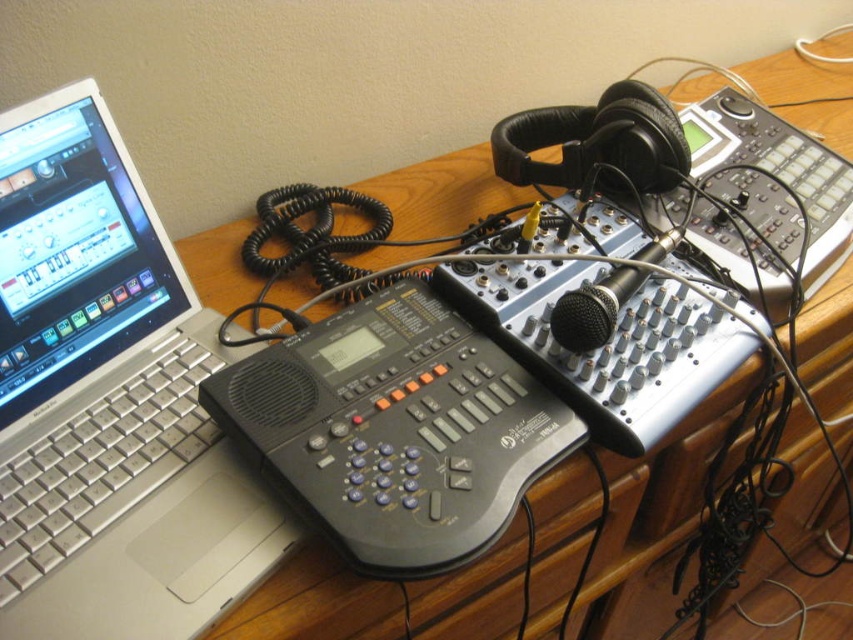
You are setting up a new microphone stand in the workspace. The silver metallic laptop at left is currently at position coordinates 0.628, 0.129. If the microphone stand requires 0.3 meters of space to the right of the laptop, will there be enough room on the desk?

The silver metallic laptop at left is located at point (109, 401). Since the desk space to the right of the laptop must accommodate the microphone stand requiring 0.3 meters, but the exact desk dimensions aren not provided in the scene description, it is impossible to determine if there is sufficient space. Please check the desk size or adjust the stand placement.

You are setting up a new monitor for your audio workstation. The monitor requires a desk space that is wider than the silver metallic laptop at left. Can the wooden desk at center accommodate this monitor?

The silver metallic laptop at left has a lesser width compared to wooden desk at center. Since the wooden desk at center is wider than the silver metallic laptop at left, it can accommodate the monitor that requires a desk space wider than the laptop.

You are a photographer taking a picture of the workspace setup. You notice two points marked in the image at coordinates point (210, 609) and point (247, 632). Which point is closer to your camera?

Point (210, 609) is closer to the camera than point (247, 632).